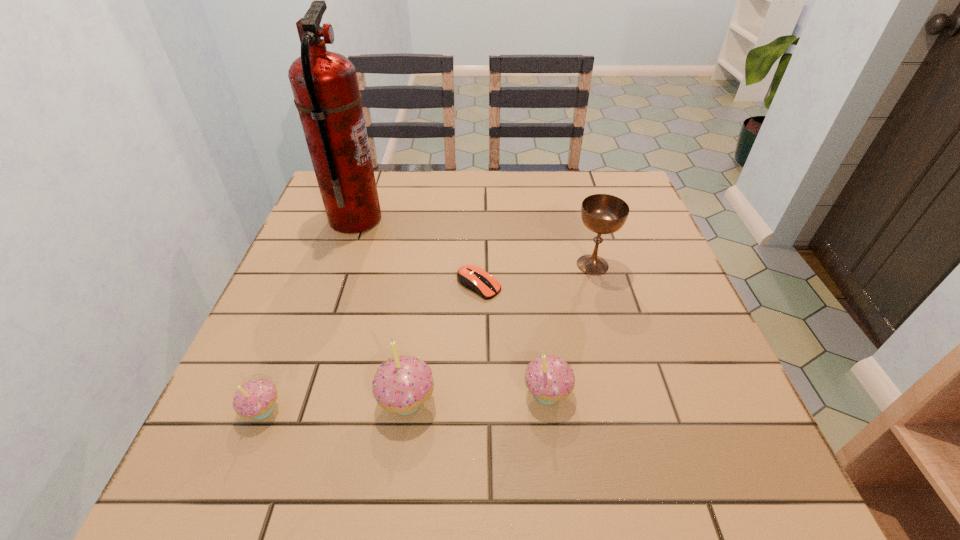
You are a GUI agent. You are given a task and a screenshot of the screen. Output one action in this format:
    pyautogui.click(x=<x>, y=<y>)
    Task: Click on the free space that satisfies the following two spatial constraints: 1. on the back side of the third object from left to right; 2. on the side of the fire extinguisher with the handle and hose
    The image size is (960, 540).
    Given the screenshot: What is the action you would take?
    pyautogui.click(x=432, y=220)

Identify the location of vacant region that satisfies the following two spatial constraints: 1. on the side of the shortest object with the handle and hose; 2. on the right side of the farthest object. (332, 285).

Identify the location of vacant space that satisfies the following two spatial constraints: 1. on the back side of the rightmost object; 2. on the right side of the fourth object from left to right. This screenshot has height=540, width=960. (479, 265).

Where is `vacant region that satisfies the following two spatial constraints: 1. on the back side of the leftmost cupcake; 2. on the left side of the second object from right to left`? The height and width of the screenshot is (540, 960). vacant region that satisfies the following two spatial constraints: 1. on the back side of the leftmost cupcake; 2. on the left side of the second object from right to left is located at coordinates (269, 393).

I want to click on vacant position in the image that satisfies the following two spatial constraints: 1. on the back side of the shortest cupcake; 2. on the left side of the rightmost cupcake, so click(269, 393).

At what (x,y) coordinates should I click in order to perform the action: click on blank area in the image that satisfies the following two spatial constraints: 1. on the side of the shortest object with the handle and hose; 2. on the left side of the tallest object. Please return your answer as a coordinate pair (x, y). This screenshot has width=960, height=540. Looking at the image, I should click on (332, 285).

Where is `vacant point that satisfies the following two spatial constraints: 1. on the side of the tallest object with the handle and hose; 2. on the front side of the shortest cupcake`? This screenshot has width=960, height=540. vacant point that satisfies the following two spatial constraints: 1. on the side of the tallest object with the handle and hose; 2. on the front side of the shortest cupcake is located at coordinates (289, 410).

This screenshot has width=960, height=540. I want to click on blank area in the image that satisfies the following two spatial constraints: 1. on the side of the second shortest cupcake with the handle and hose; 2. on the left side of the tallest object, so click(295, 393).

Identify the location of vacant space that satisfies the following two spatial constraints: 1. on the side of the chalice with the handle and hose; 2. on the left side of the tallest object. [x=340, y=265].